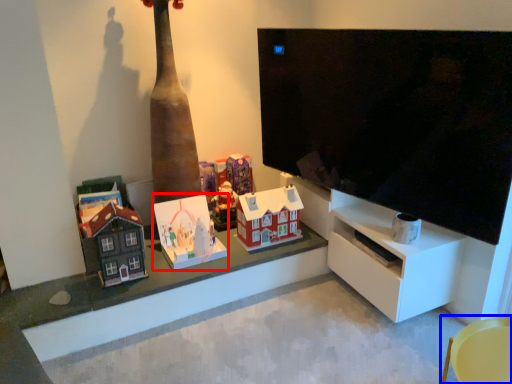
Question: Which of the following is the closest to the observer, toy (highlighted by a red box) or furniture (highlighted by a blue box)?

Choices:
 (A) toy
 (B) furniture

Answer: (B)